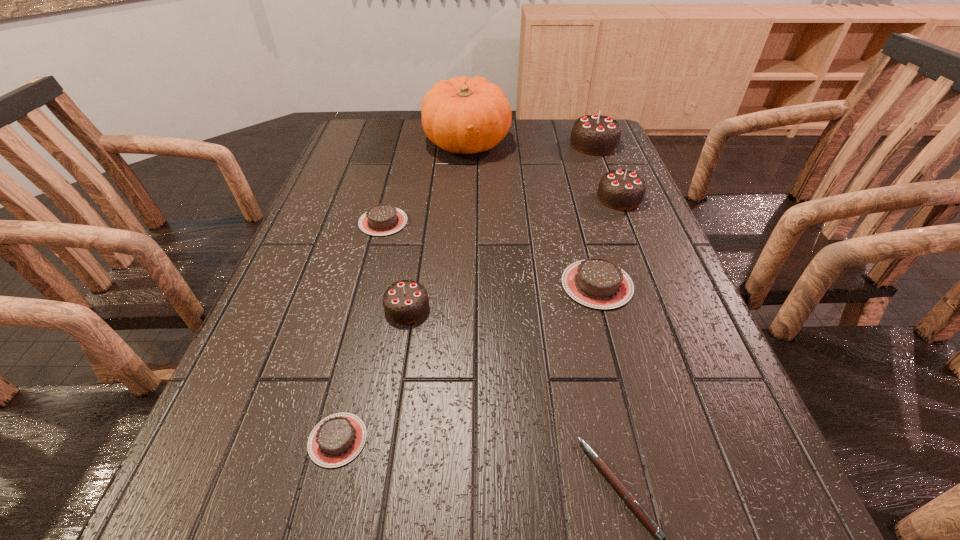
Find the location of a particular element. brown chocolate cake that can be found as the third closest to the pink pen is located at coordinates (382, 219).

Where is `the closest brown chocolate cake to the nearest brown chocolate cake`? The height and width of the screenshot is (540, 960). the closest brown chocolate cake to the nearest brown chocolate cake is located at coordinates (599, 283).

Identify the location of free point that satisfies the following two spatial constraints: 1. on the back side of the orange pumpkin; 2. on the left side of the fourth shortest chocolate cake. The width and height of the screenshot is (960, 540). (433, 143).

The width and height of the screenshot is (960, 540). In order to click on free spot that satisfies the following two spatial constraints: 1. on the front side of the pumpkin; 2. on the left side of the third shortest chocolate cake in this screenshot , I will do `click(460, 285)`.